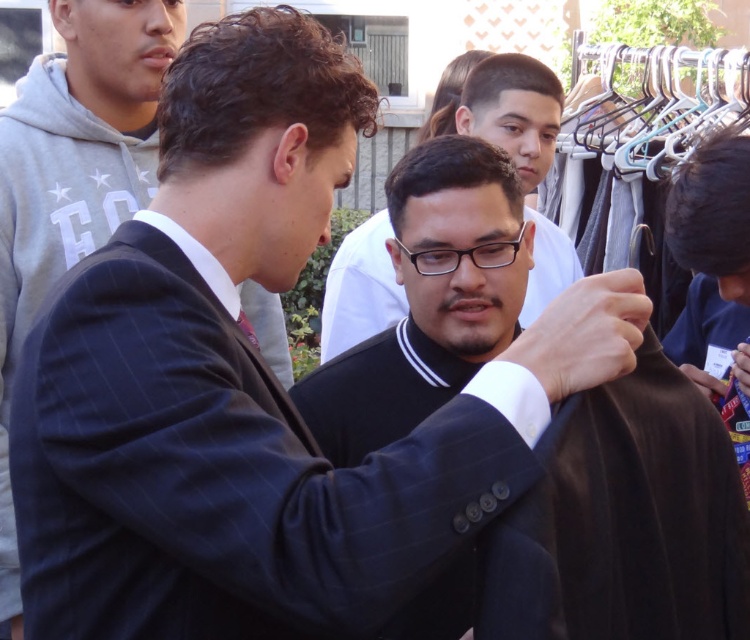
You are standing at the origin point in the image. In which direction should you move to reach the dark blue pinstripe suit at center?

To reach the dark blue pinstripe suit at center located at point (74, 172), you should move towards the right and slightly downward from the origin point.

From the picture: You are a tailor trying to hang the black smooth shirt at center and the metallic silver hanger at upper right. Based on their sizes, which one requires a wider space on the rack?

The black smooth shirt at center requires a wider space on the rack because its width is larger than the metallic silver hanger at upper right.

You are a fashion designer trying to arrange clothing items on a rack. You have the black smooth shirt at center and the metallic silver hanger at upper right. Which item should you place higher on the rack to ensure visibility?

The metallic silver hanger at upper right should be placed higher on the rack since the black smooth shirt at center is shorter in height compared to the metallic silver hanger at upper right, making the taller hanger more visible when placed higher.